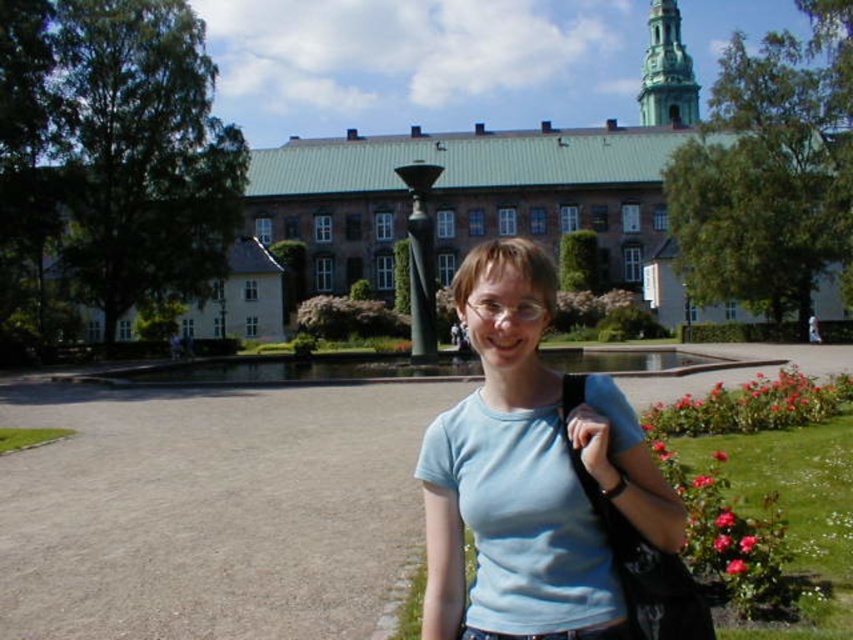
Is light blue cotton t-shirt at center to the left of green stone spire at upper center from the viewer's perspective?

Correct, you'll find light blue cotton t-shirt at center to the left of green stone spire at upper center.

Between light blue cotton t-shirt at center and green stone spire at upper center, which one is positioned lower?

light blue cotton t-shirt at center is below.

Identify the location of light blue cotton t-shirt at center. The height and width of the screenshot is (640, 853). (529, 474).